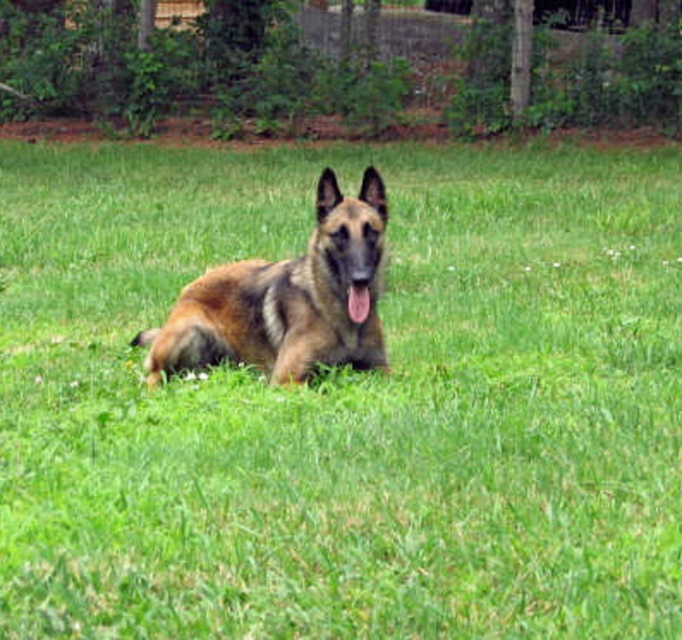
How far apart are brown fur dog at center and pink glossy tongue at center?

The distance of brown fur dog at center from pink glossy tongue at center is 14.08 inches.

Based on the photo, between brown fur dog at center and pink glossy tongue at center, which one has more height?

brown fur dog at center

This screenshot has height=640, width=682. What are the coordinates of `brown fur dog at center` in the screenshot? It's located at click(284, 300).

At what (x,y) coordinates should I click in order to perform the action: click on brown fur dog at center. Please return your answer as a coordinate pair (x, y). The height and width of the screenshot is (640, 682). Looking at the image, I should click on (284, 300).